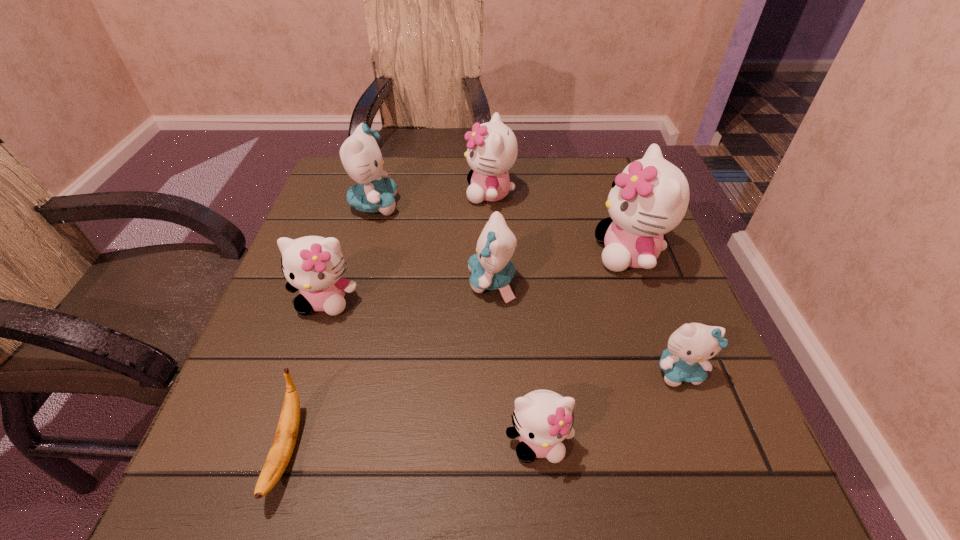
Image resolution: width=960 pixels, height=540 pixels. In order to click on object located in the near left corner section of the desktop in this screenshot , I will do `click(284, 441)`.

The width and height of the screenshot is (960, 540). I want to click on free space at the far edge of the desktop, so click(459, 186).

Identify the location of vacant region at the near edge of the desktop. (567, 470).

Where is `free spot at the left edge of the desktop`? free spot at the left edge of the desktop is located at coordinates (353, 241).

In the image, there is a desktop. Where is `vacant space at the right edge`? The image size is (960, 540). vacant space at the right edge is located at coordinates (659, 399).

This screenshot has height=540, width=960. What are the coordinates of `free region at the near left corner of the desktop` in the screenshot? It's located at (217, 493).

Identify the location of vacant point at the far right corner. (587, 163).

You are a GUI agent. You are given a task and a screenshot of the screen. Output one action in this format:
    pyautogui.click(x=<x>, y=<y>)
    Task: Click on the vacant region at the near right corner of the desktop
    
    Given the screenshot: What is the action you would take?
    pyautogui.click(x=659, y=470)

The height and width of the screenshot is (540, 960). Identify the location of vacant region between the sixth farthest object and the banana. (483, 410).

Find the location of a particular element. This screenshot has height=540, width=960. free space between the leftmost blue kitten and the yellow banana is located at coordinates (330, 327).